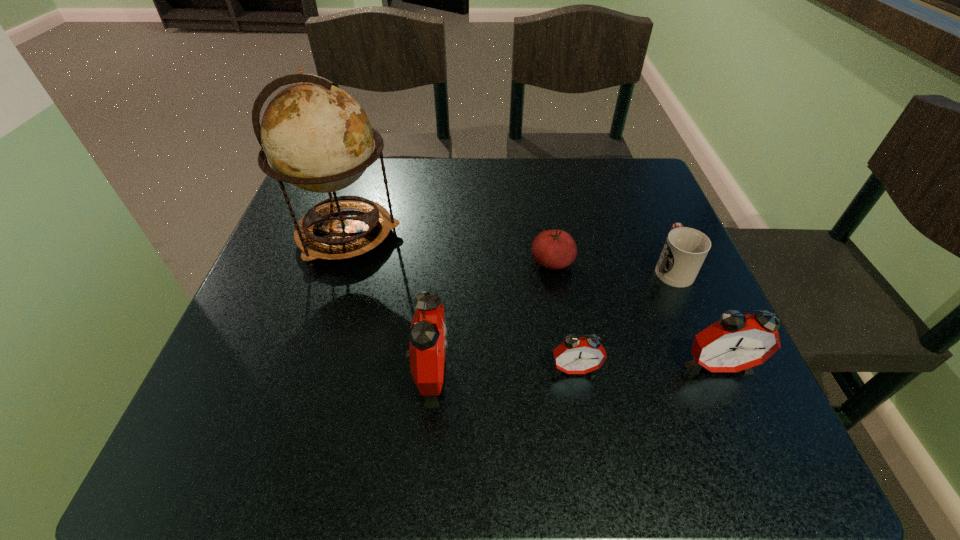
Where is `free space at the far edge of the desktop`? The width and height of the screenshot is (960, 540). free space at the far edge of the desktop is located at coordinates (505, 161).

In the image, there is a desktop. Identify the location of vacant space at the near edge. (325, 369).

The image size is (960, 540). What are the coordinates of `free space at the right edge` in the screenshot? It's located at (690, 287).

Locate an element on the screen. Image resolution: width=960 pixels, height=540 pixels. free space at the far left corner of the desktop is located at coordinates (367, 173).

In the image, there is a desktop. Identify the location of vacant space at the far right corner. The height and width of the screenshot is (540, 960). (660, 204).

Where is `blank region between the tomato and the second alarm clock from right to left`? blank region between the tomato and the second alarm clock from right to left is located at coordinates (564, 316).

Locate an element on the screen. This screenshot has width=960, height=540. unoccupied position between the leftmost object and the second alarm clock from left to right is located at coordinates (461, 302).

The image size is (960, 540). Identify the location of unoccupied position between the fifth object from right to left and the cup. (551, 321).

You are a GUI agent. You are given a task and a screenshot of the screen. Output one action in this format:
    pyautogui.click(x=<x>, y=<y>)
    Task: Click on the free space between the second alarm clock from right to left and the second object from left to right
    
    Given the screenshot: What is the action you would take?
    pyautogui.click(x=502, y=372)

The height and width of the screenshot is (540, 960). I want to click on empty location between the cup and the rightmost alarm clock, so click(x=695, y=316).